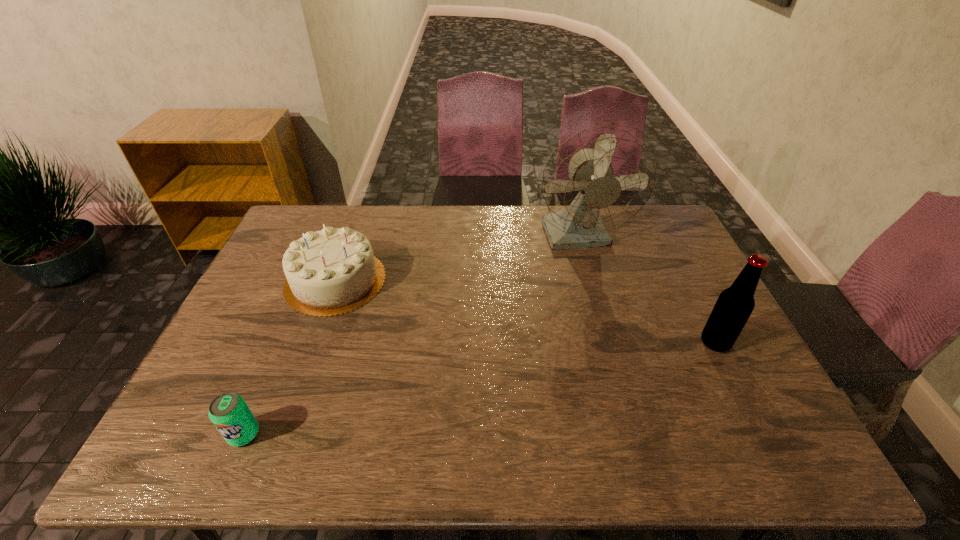
This screenshot has width=960, height=540. In order to click on the tallest object in this screenshot , I will do `click(600, 178)`.

The height and width of the screenshot is (540, 960). In order to click on the third object from left to right in this screenshot , I will do `click(600, 178)`.

At what (x,y) coordinates should I click in order to perform the action: click on the second nearest object. Please return your answer as a coordinate pair (x, y). The image size is (960, 540). Looking at the image, I should click on (735, 304).

This screenshot has width=960, height=540. Find the location of `beer bottle`. beer bottle is located at coordinates (735, 304).

Image resolution: width=960 pixels, height=540 pixels. Identify the location of the second shortest object. click(x=333, y=271).

You are a GUI agent. You are given a task and a screenshot of the screen. Output one action in this format:
    pyautogui.click(x=<x>, y=<y>)
    Task: Click on the shortest object
    The height and width of the screenshot is (540, 960).
    Given the screenshot: What is the action you would take?
    pyautogui.click(x=229, y=413)

This screenshot has height=540, width=960. Identify the location of the nearest object. (229, 413).

Identify the location of free space located in front of the third object from left to right to blow air. This screenshot has height=540, width=960. (615, 364).

I want to click on vacant position located on the back of the rightmost object, so click(x=692, y=298).

Locate an element on the screen. The height and width of the screenshot is (540, 960). vacant space situated 0.360m on the front of the birthday cake is located at coordinates (279, 436).